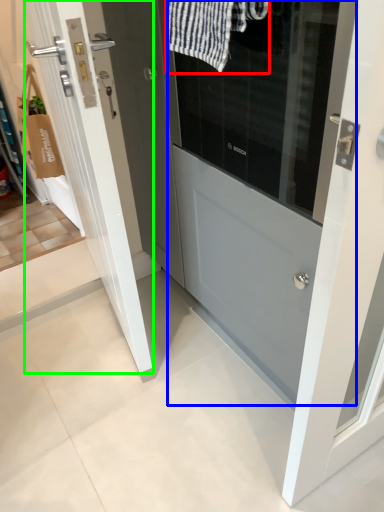
Question: Which is nearer to the bath towel (highlighted by a red box)? door (highlighted by a blue box) or door (highlighted by a green box).

Choices:
 (A) door
 (B) door

Answer: (A)